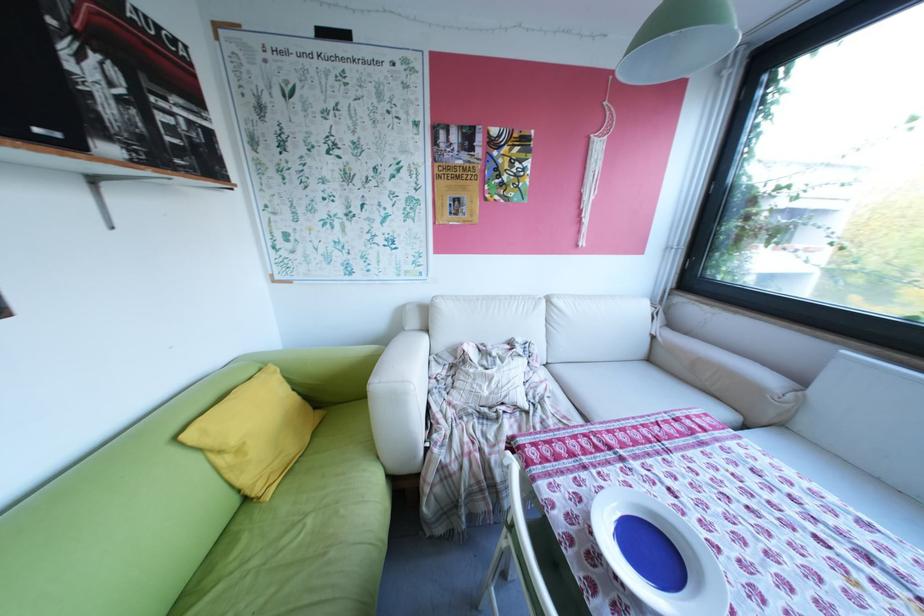
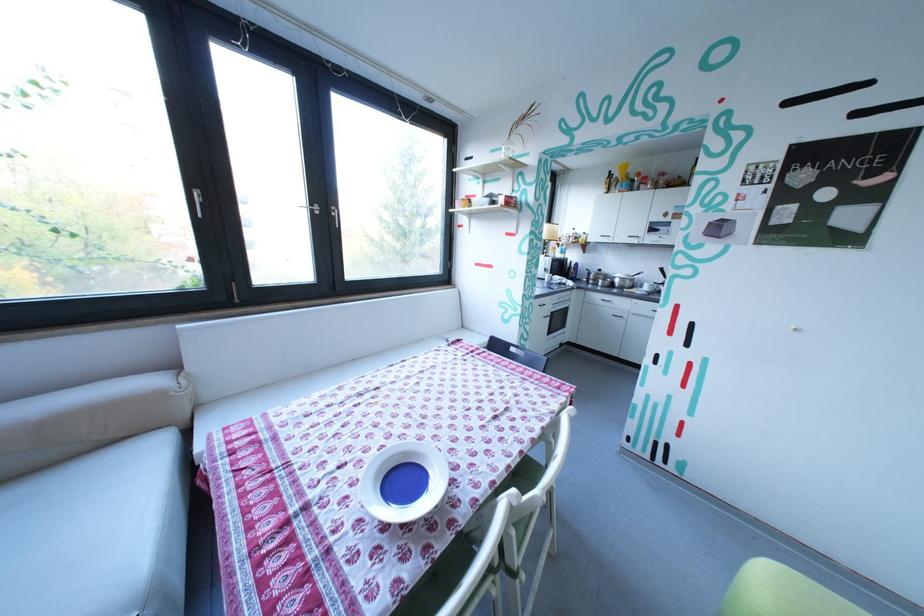
Where in the second image is the point corresponding to (735,559) from the first image?

(400, 446)